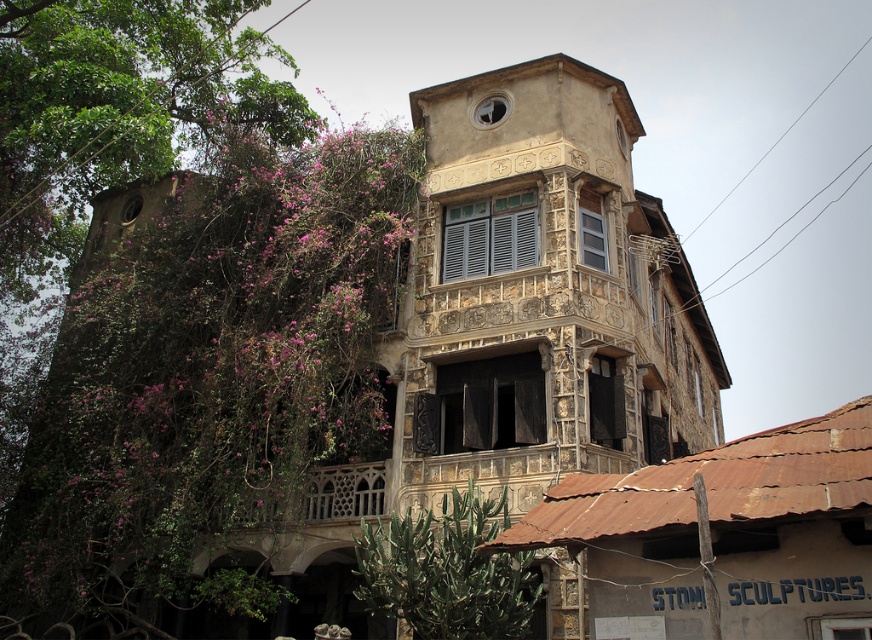
Question: In this image, where is green leafy tree at left located relative to carved stone balcony at center?

Choices:
 (A) right
 (B) left

Answer: (B)

Question: Based on their relative distances, which object is nearer to the green leafy tree at left?

Choices:
 (A) green leafy plant at lower center
 (B) carved stone balcony at center

Answer: (A)

Question: Which point is closer to the camera?

Choices:
 (A) (452, 605)
 (B) (334, 372)

Answer: (A)

Question: Does green leafy tree at left lie behind carved stone balcony at center?

Choices:
 (A) no
 (B) yes

Answer: (A)

Question: Does green leafy plant at lower center lie behind carved stone balcony at center?

Choices:
 (A) yes
 (B) no

Answer: (B)

Question: Which of the following is the farthest from the observer?

Choices:
 (A) (118, 566)
 (B) (263, 497)

Answer: (A)